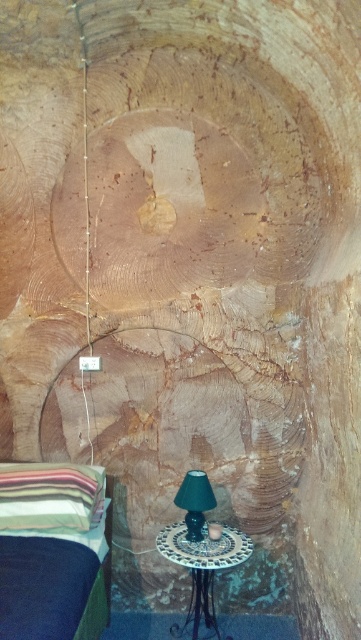
You are a GUI agent. You are given a task and a screenshot of the screen. Output one action in this format:
    pyautogui.click(x=<x>, y=<y>)
    Task: Click on the porcelain mosaic table at center
    
    Given the screenshot: What is the action you would take?
    pyautogui.click(x=202, y=563)

Is porcelain mosaic table at center taller than green fabric lampshade at lower center?

Indeed, porcelain mosaic table at center has a greater height compared to green fabric lampshade at lower center.

Is point (172, 529) closer to camera compared to point (197, 525)?

No, it is behind (197, 525).

You are a GUI agent. You are given a task and a screenshot of the screen. Output one action in this format:
    pyautogui.click(x=<x>, y=<y>)
    Task: Click on the porcelain mosaic table at center
    The width and height of the screenshot is (361, 640).
    Given the screenshot: What is the action you would take?
    pyautogui.click(x=202, y=563)

The height and width of the screenshot is (640, 361). What do you see at coordinates (50, 497) in the screenshot? I see `striped fabric pillow at lower left` at bounding box center [50, 497].

Is striped fabric pillow at lower left further to camera compared to green fabric lampshade at lower center?

That is False.

Who is more distant from viewer, (94, 468) or (192, 477)?

The point (94, 468) is more distant.

I want to click on striped fabric pillow at lower left, so click(x=50, y=497).

Who is positioned more to the left, striped fabric bed at lower left or porcelain mosaic table at center?

striped fabric bed at lower left is more to the left.

Describe the element at coordinates (51, 552) in the screenshot. I see `striped fabric bed at lower left` at that location.

Where is `striped fabric bed at lower left`? The height and width of the screenshot is (640, 361). striped fabric bed at lower left is located at coordinates (51, 552).